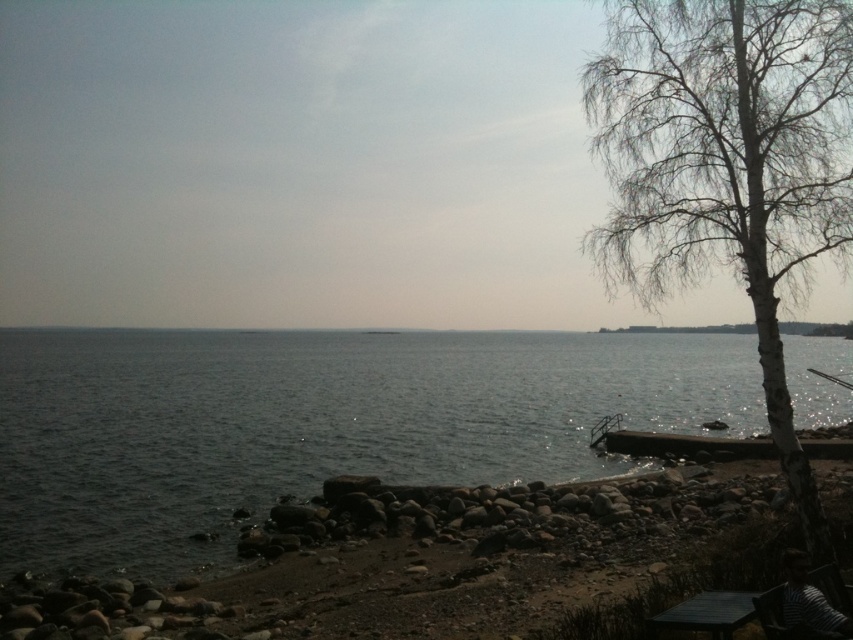
Does dark gray water at center have a larger size compared to white bark tree at right?

Yes, dark gray water at center is bigger than white bark tree at right.

This screenshot has width=853, height=640. What do you see at coordinates (314, 424) in the screenshot?
I see `dark gray water at center` at bounding box center [314, 424].

This screenshot has width=853, height=640. Describe the element at coordinates (314, 424) in the screenshot. I see `dark gray water at center` at that location.

The width and height of the screenshot is (853, 640). In order to click on dark gray water at center in this screenshot , I will do `click(314, 424)`.